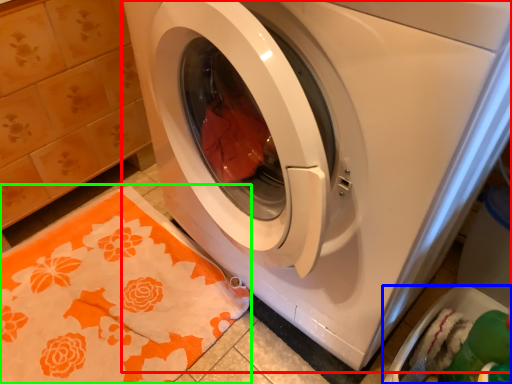
Question: Based on their relative distances, which object is nearer to washing machine (highlighted by a red box)? Choose from dish washer (highlighted by a blue box) and blanket (highlighted by a green box).

Choices:
 (A) dish washer
 (B) blanket

Answer: (B)